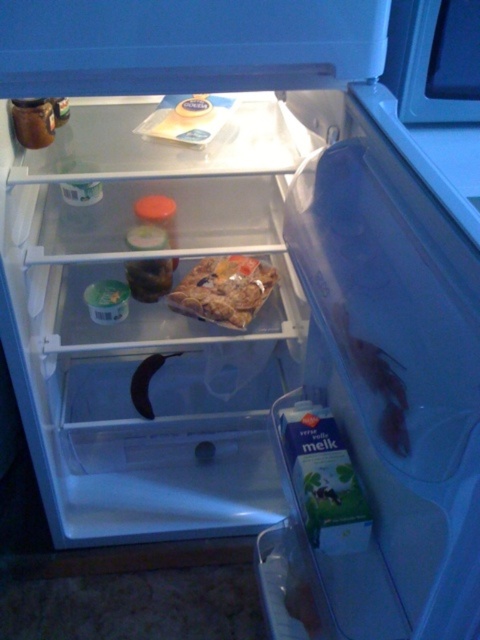
Question: Which object appears farthest from the camera in this image?

Choices:
 (A) translucent plastic bag of cookies at center
 (B) translucent plastic milk carton at lower right

Answer: (A)

Question: Does translucent plastic bag of cookies at center have a larger size compared to translucent plastic milk carton at lower right?

Choices:
 (A) yes
 (B) no

Answer: (A)

Question: Which of the following is the closest to the observer?

Choices:
 (A) (240, 317)
 (B) (398, 452)

Answer: (B)

Question: Which point appears closest to the camera in this image?

Choices:
 (A) (396, 413)
 (B) (254, 301)

Answer: (A)

Question: Is translucent plastic bag of cookies at center to the right of translucent plastic milk carton at lower right from the viewer's perspective?

Choices:
 (A) no
 (B) yes

Answer: (A)

Question: Can you confirm if translucent plastic bag of cookies at center is positioned to the right of translucent plastic milk carton at lower right?

Choices:
 (A) yes
 (B) no

Answer: (B)